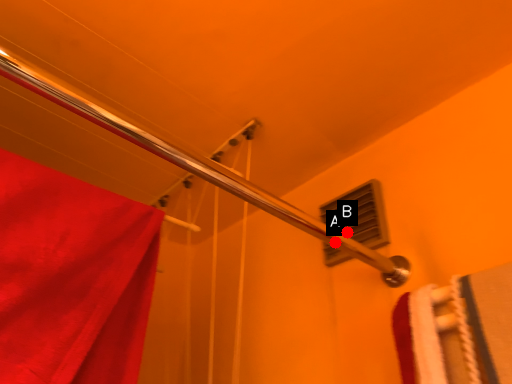
Question: Two points are circled on the image, labeled by A and B beside each circle. Which point is closer to the camera?

Choices:
 (A) A is closer
 (B) B is closer

Answer: (B)